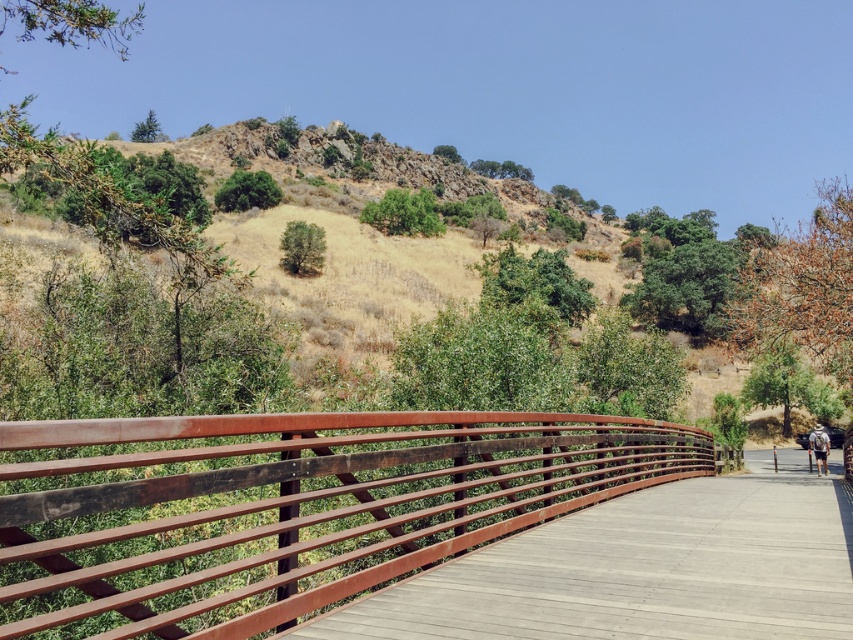
Question: Is rustic wood rail at center below wooden bridge at center?

Choices:
 (A) yes
 (B) no

Answer: (B)

Question: Which point is closer to the camera?

Choices:
 (A) rustic wood rail at center
 (B) white fabric backpack at lower right

Answer: (A)

Question: In this image, where is wooden bridge at center located relative to white fabric backpack at lower right?

Choices:
 (A) left
 (B) right

Answer: (A)

Question: From the image, what is the correct spatial relationship of wooden bridge at center in relation to white fabric backpack at lower right?

Choices:
 (A) right
 (B) left

Answer: (B)

Question: Among these objects, which one is nearest to the camera?

Choices:
 (A) rustic wood rail at center
 (B) white fabric backpack at lower right
 (C) wooden bridge at center

Answer: (A)

Question: Which point is farther from the camera taking this photo?

Choices:
 (A) (720, 520)
 (B) (816, 426)
 (C) (207, 547)

Answer: (B)